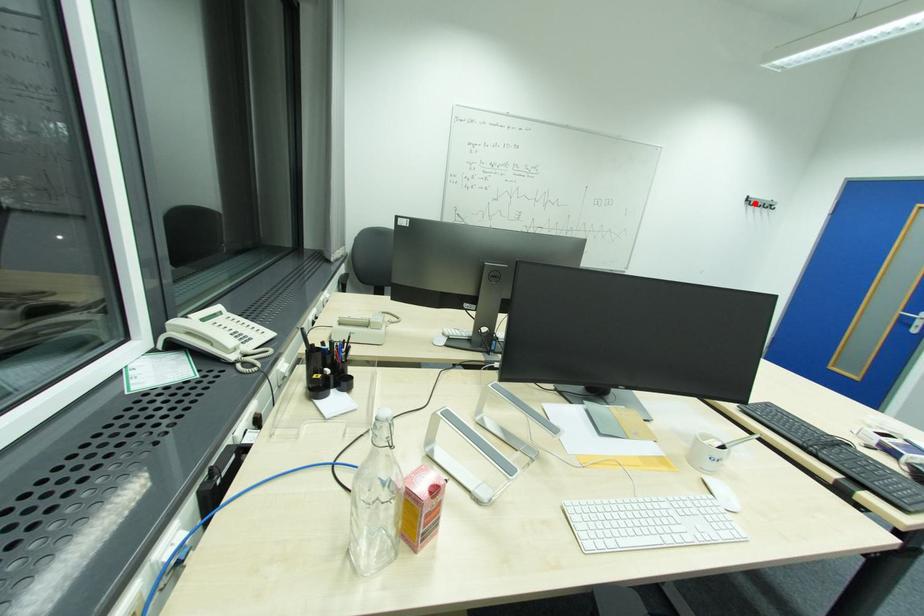
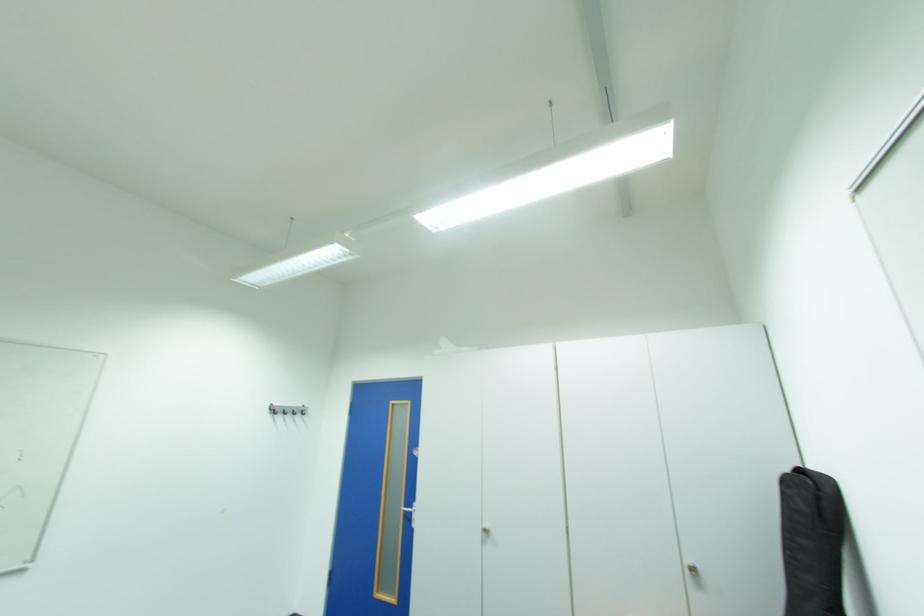
Find the pixel in the second image that matches the highlighted location in the first image.

(280, 411)